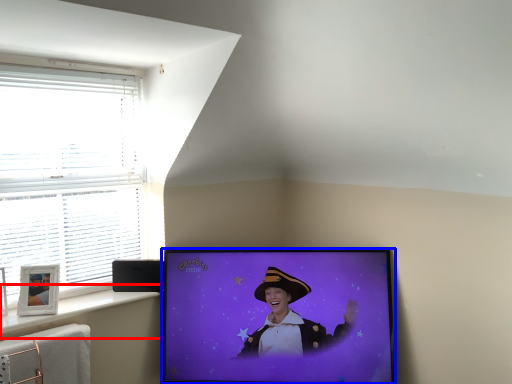
Question: Which object appears farthest to the camera in this image, window sill (highlighted by a red box) or television (highlighted by a blue box)?

Choices:
 (A) window sill
 (B) television

Answer: (B)